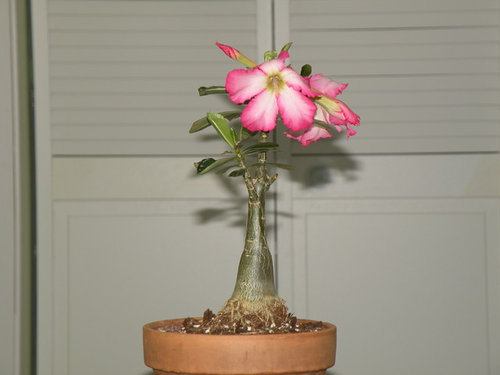
Where is `gap in closet door`? gap in closet door is located at coordinates (33, 197).